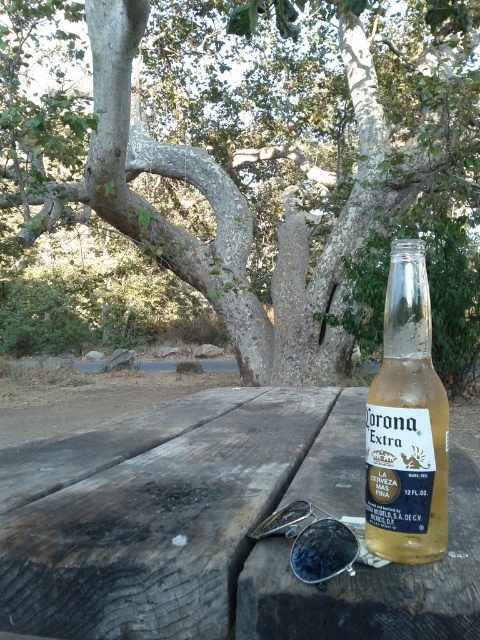
Question: Which of the following is the farthest from the observer?

Choices:
 (A) (303, 276)
 (B) (392, 461)
 (C) (183, 509)

Answer: (A)

Question: Is wooden at center positioned behind translucent glass bottle at center?

Choices:
 (A) yes
 (B) no

Answer: (B)

Question: Which object appears farthest from the camera in this image?

Choices:
 (A) smooth gray bark tree at center
 (B) translucent glass bottle at center

Answer: (A)

Question: Can you confirm if smooth gray bark tree at center is positioned to the left of translucent glass bottle at center?

Choices:
 (A) yes
 (B) no

Answer: (A)

Question: Estimate the real-world distances between objects in this image. Which object is closer to the translucent glass bottle at center?

Choices:
 (A) wooden at center
 (B) smooth gray bark tree at center

Answer: (A)

Question: From the image, what is the correct spatial relationship of wooden at center in relation to translucent glass bottle at center?

Choices:
 (A) right
 (B) left

Answer: (B)